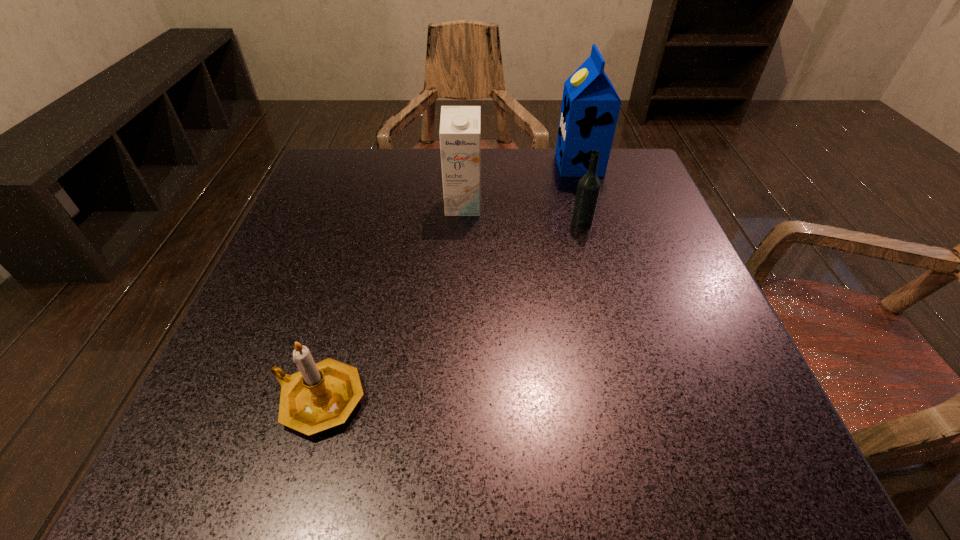
Find the location of `vacant space in between the farther carton and the second farthest object`. vacant space in between the farther carton and the second farthest object is located at coordinates (521, 185).

This screenshot has width=960, height=540. I want to click on vacant region between the vodka and the nearer carton, so click(x=522, y=214).

Locate an element on the screen. This screenshot has width=960, height=540. vacant point located between the left carton and the candle holder is located at coordinates (391, 303).

The image size is (960, 540). What are the coordinates of `unoccupied area between the farthest object and the nearest object` in the screenshot? It's located at (449, 282).

Locate an element on the screen. This screenshot has height=540, width=960. free space between the nearer carton and the vodka is located at coordinates click(522, 214).

Where is `the closest object relative to the second tallest object`? The image size is (960, 540). the closest object relative to the second tallest object is located at coordinates (589, 186).

Identify which object is the third closest to the shortest object. Please provide its 2D coordinates. Your answer should be formatted as a tuple, i.e. [(x, y)], where the tuple contains the x and y coordinates of a point satisfying the conditions above.

[(590, 107)]